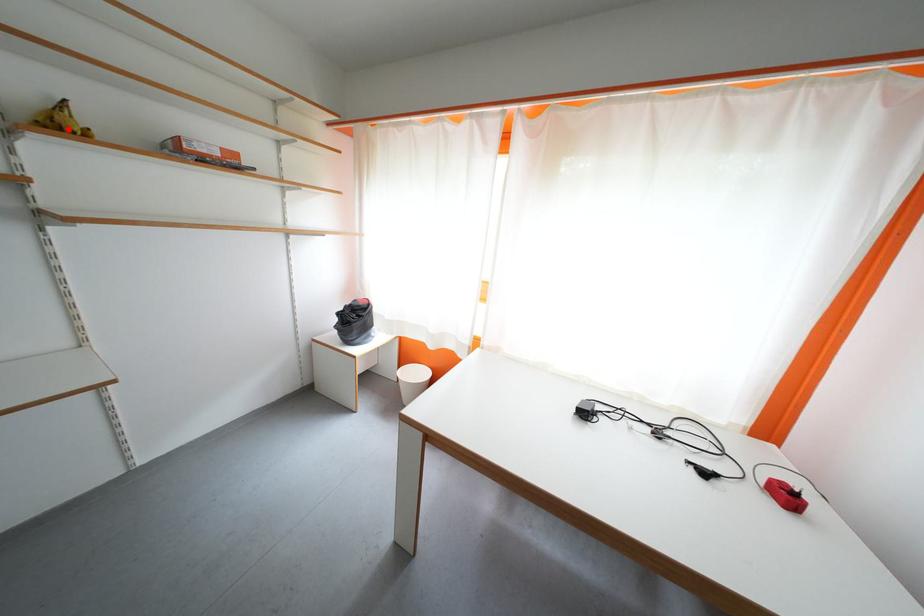
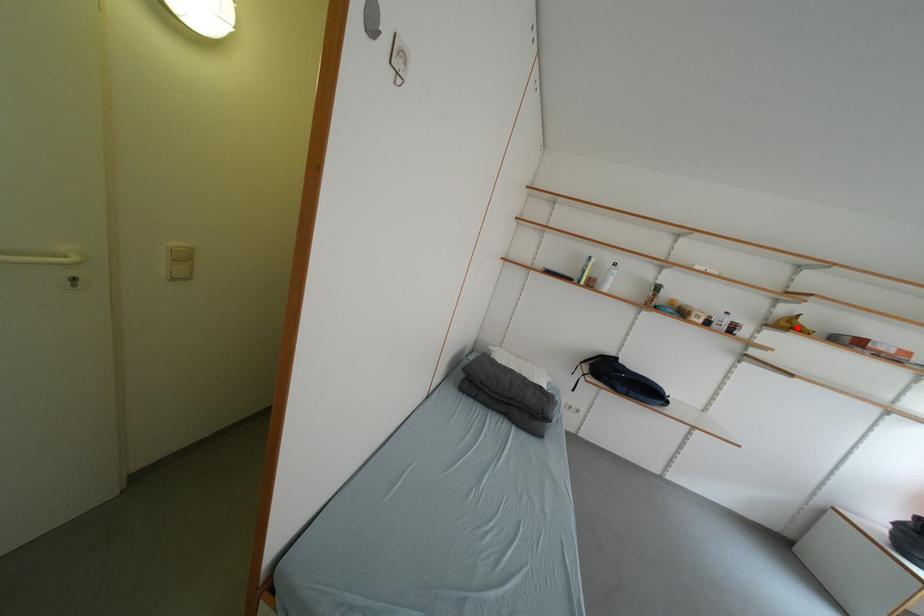
I am providing you with two images of the same scene from different viewpoints. A red point is marked on the first image and another point is marked on the second image. Are the points marked in image1 and image2 representing the same 3D position?

Yes